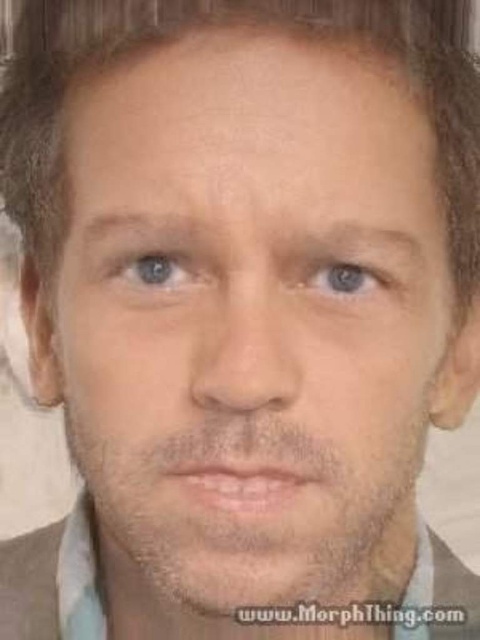
Question: Is blue matte eye at upper left below blue matte eye at center?

Choices:
 (A) yes
 (B) no

Answer: (B)

Question: Is blue matte eye at upper left thinner than blue matte eye at center?

Choices:
 (A) no
 (B) yes

Answer: (A)

Question: Is blue matte eye at upper left further to the viewer compared to blue matte eye at center?

Choices:
 (A) yes
 (B) no

Answer: (B)

Question: Which point is closer to the camera?

Choices:
 (A) click(x=373, y=269)
 (B) click(x=193, y=268)

Answer: (B)